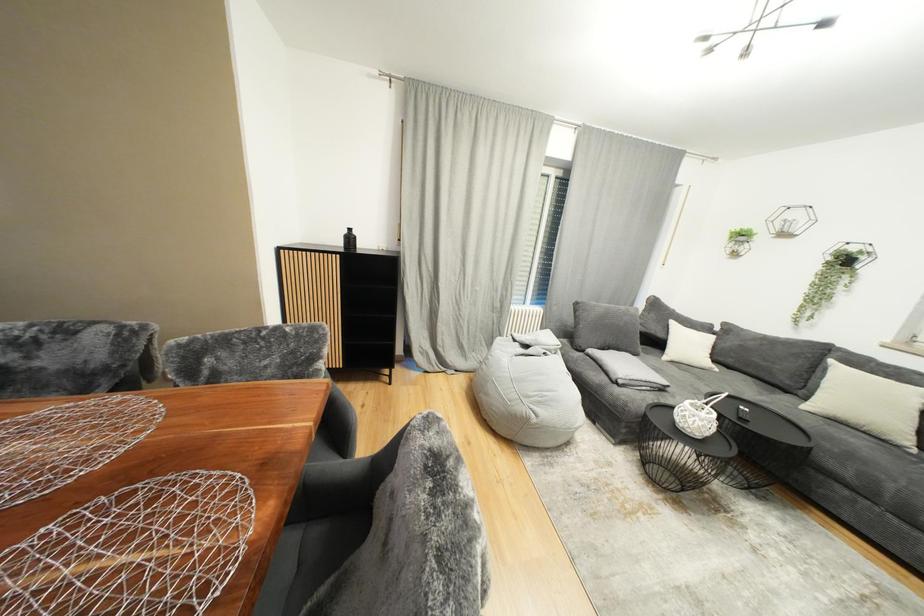
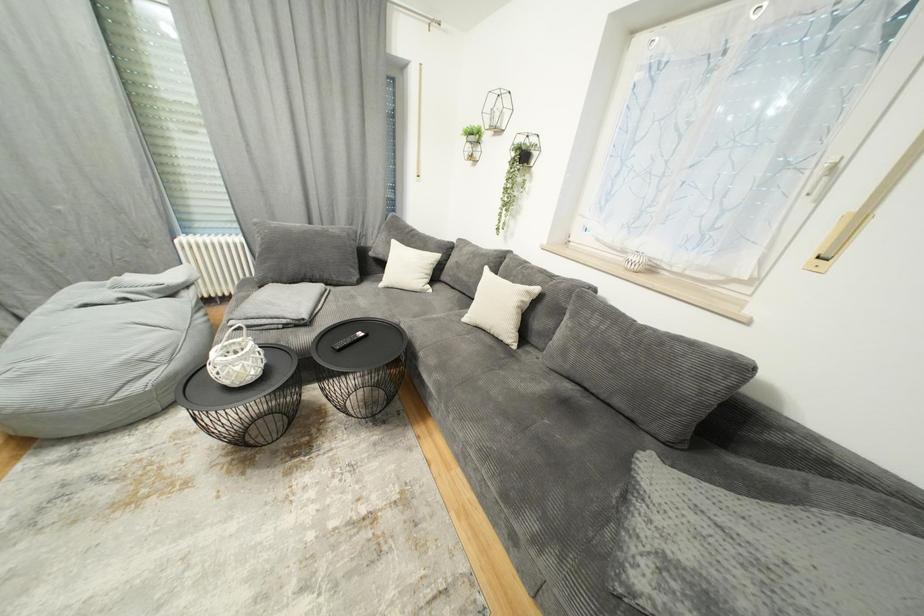
Question: What movement of the cameraman would produce the second image?

Choices:
 (A) Left
 (B) Right
 (C) Forward
 (D) Backward

Answer: (B)